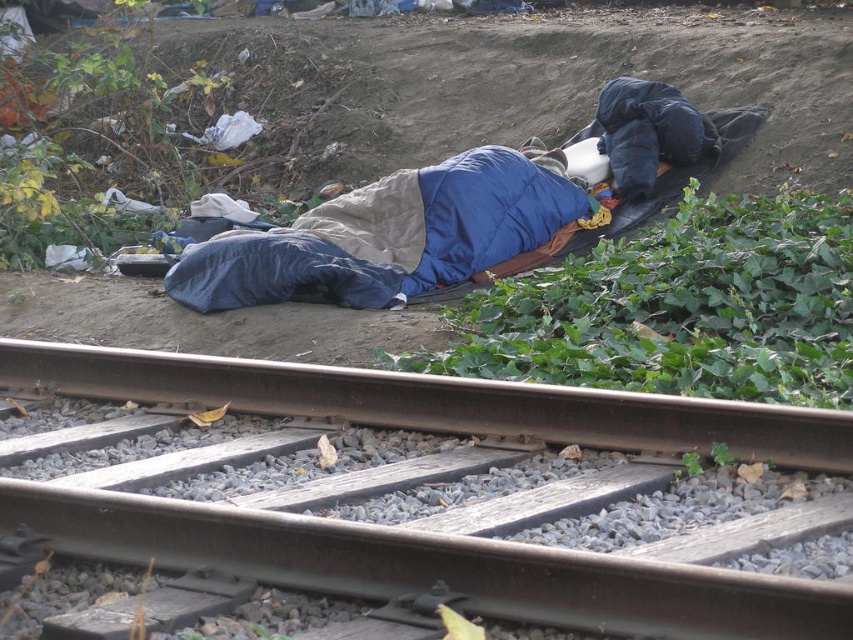
You are a hiker who has stumbled upon this scene. You need to determine if the blue down jacket at center can be placed on top of the brushed metal railway line at center without overlapping the gravel. Based on their sizes, is this possible?

The blue down jacket at center is larger than the brushed metal railway line at center. Since the jacket is bigger, placing it entirely on the railway line without overlapping the gravel would be challenging as the jacket might extend beyond the line.